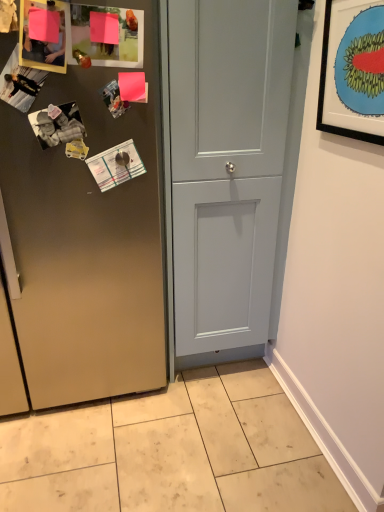
Question: Visually, is satin finish cabinet at center, which is the 2th door in right-to-left order, positioned to the left or to the right of light gray wood door at center, the second door from the left?

Choices:
 (A) right
 (B) left

Answer: (B)

Question: Considering the positions of satin finish cabinet at center, which is the 2th door in right-to-left order, and light gray wood door at center, the second door from the left, in the image, is satin finish cabinet at center, which is the 2th door in right-to-left order, taller or shorter than light gray wood door at center, the second door from the left,?

Choices:
 (A) tall
 (B) short

Answer: (B)

Question: Estimate the real-world distances between objects in this image. Which object is farther from the beige tile at lower center?

Choices:
 (A) black matte picture frame at upper right
 (B) satin finish cabinet at center, the first door in the left-to-right sequence
 (C) light gray wood door at center, the first door positioned from the right

Answer: (A)

Question: Considering the real-world distances, which object is closest to the satin finish cabinet at center, which is the 2th door in right-to-left order?

Choices:
 (A) black matte picture frame at upper right
 (B) beige tile at lower center
 (C) light gray wood door at center, the first door positioned from the right

Answer: (C)